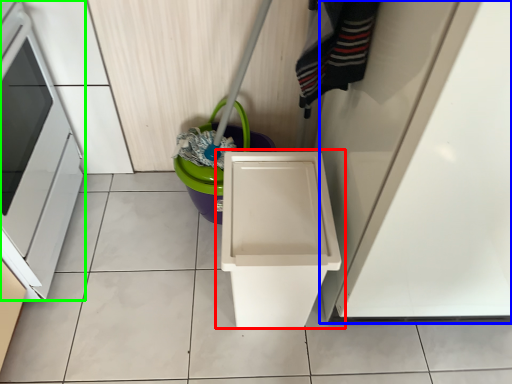
Question: Which object is positioned farthest from waste container (highlighted by a red box)? Select from door (highlighted by a blue box) and oven (highlighted by a green box).

Choices:
 (A) door
 (B) oven

Answer: (B)